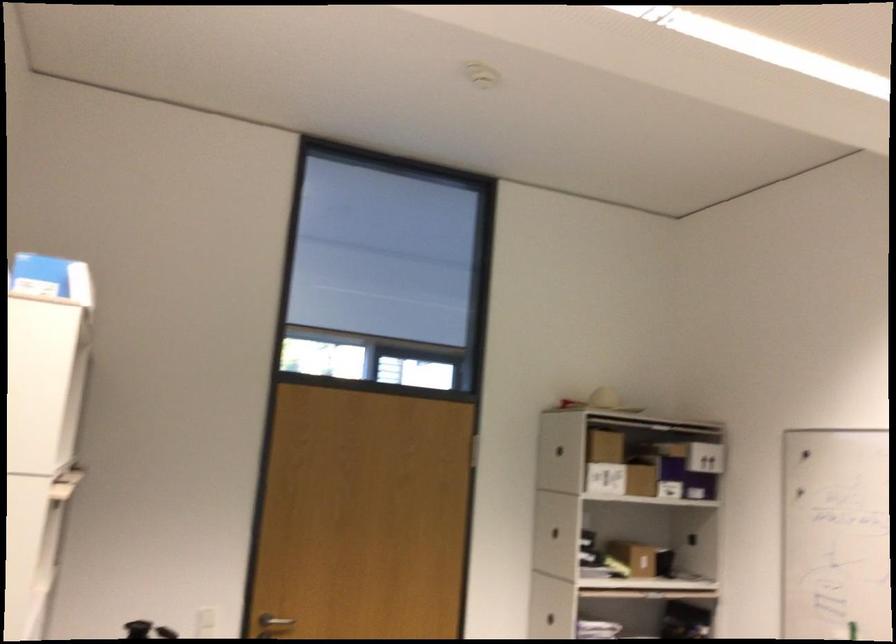
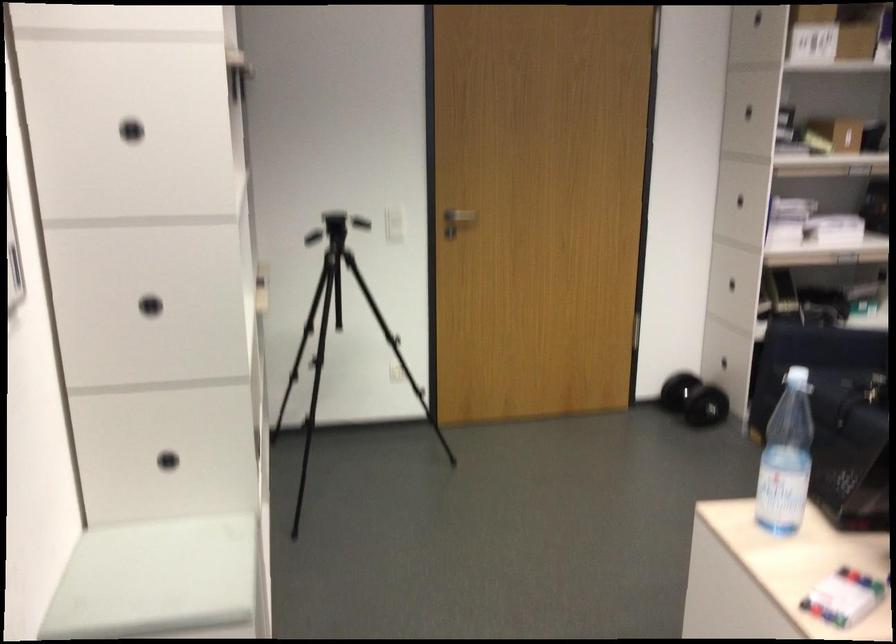
Question: Based on the continuous images, in which direction is the camera rotating? Reply with the corresponding letter.

Choices:
 (A) Left
 (B) Right
 (C) Up
 (D) Down

Answer: (D)